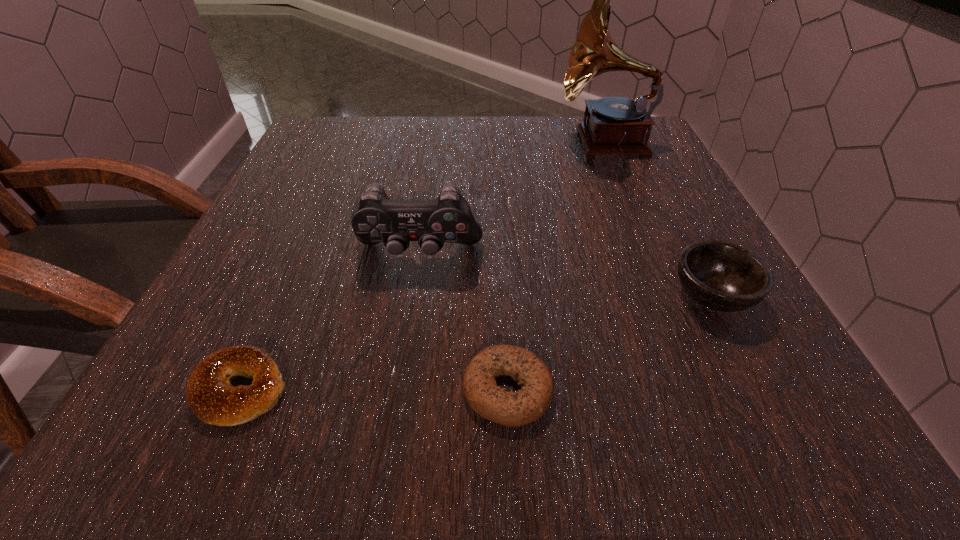
Find the location of a particular element. vacant space in between the phonograph_record and the third tallest object is located at coordinates (659, 218).

You are a GUI agent. You are given a task and a screenshot of the screen. Output one action in this format:
    pyautogui.click(x=<x>, y=<y>)
    Task: Click on the blank region between the control and the farthest object
    
    Given the screenshot: What is the action you would take?
    pyautogui.click(x=512, y=198)

Locate an element on the screen. This screenshot has height=540, width=960. empty location between the phonograph_record and the right bagel is located at coordinates (556, 265).

This screenshot has width=960, height=540. Find the location of `empty space that is in between the right bagel and the leftmost object`. empty space that is in between the right bagel and the leftmost object is located at coordinates (374, 389).

At what (x,y) coordinates should I click in order to perform the action: click on object that ranks as the second closest to the leftmost object. Please return your answer as a coordinate pair (x, y). The height and width of the screenshot is (540, 960). Looking at the image, I should click on (533, 377).

This screenshot has width=960, height=540. What are the coordinates of `object that can be found as the third closest to the right bagel` in the screenshot? It's located at (210, 395).

This screenshot has height=540, width=960. I want to click on vacant space that satisfies the following two spatial constraints: 1. on the horn of the phonograph_record; 2. on the front side of the leftmost object, so click(x=710, y=389).

Where is `free point that satisfies the following two spatial constraints: 1. on the horn of the phonograph_record; 2. on the surface of the second tallest object with buttons`? free point that satisfies the following two spatial constraints: 1. on the horn of the phonograph_record; 2. on the surface of the second tallest object with buttons is located at coordinates (654, 255).

You are a GUI agent. You are given a task and a screenshot of the screen. Output one action in this format:
    pyautogui.click(x=<x>, y=<y>)
    Task: Click on the vacant region that satisfies the following two spatial constraints: 1. on the surface of the fourth shortest object with buttons; 2. on the right side of the bowl
    This screenshot has width=960, height=540.
    Given the screenshot: What is the action you would take?
    pyautogui.click(x=412, y=295)

This screenshot has width=960, height=540. What are the coordinates of `vacant area in the image that satisfies the following two spatial constraints: 1. on the surface of the control with buttons; 2. on the left side of the bowl` in the screenshot? It's located at (412, 295).